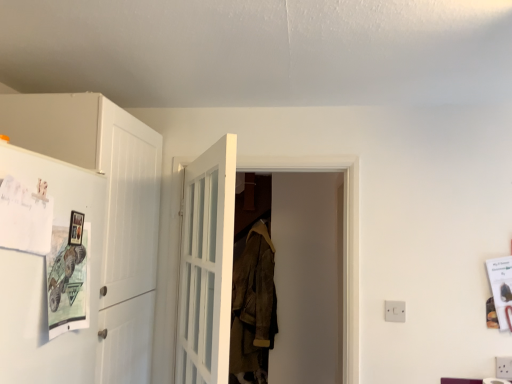
Question: Is white matte refrigerator at left oriented towards leather jacket at center?

Choices:
 (A) yes
 (B) no

Answer: (B)

Question: Is white matte refrigerator at left far away from leather jacket at center?

Choices:
 (A) no
 (B) yes

Answer: (B)

Question: Is white matte refrigerator at left beside leather jacket at center?

Choices:
 (A) no
 (B) yes

Answer: (A)

Question: Considering the relative sizes of white matte refrigerator at left and leather jacket at center in the image provided, is white matte refrigerator at left wider than leather jacket at center?

Choices:
 (A) no
 (B) yes

Answer: (B)

Question: Considering the relative sizes of white matte refrigerator at left and leather jacket at center in the image provided, is white matte refrigerator at left taller than leather jacket at center?

Choices:
 (A) no
 (B) yes

Answer: (B)

Question: Is white glass door at center, the 2th door viewed from the back, bigger or smaller than white matte refrigerator at left?

Choices:
 (A) small
 (B) big

Answer: (A)

Question: From the image's perspective, is white glass door at center, the first door positioned from the front, above or below white matte refrigerator at left?

Choices:
 (A) below
 (B) above

Answer: (A)

Question: Considering the relative positions of white glass door at center, the 2th door viewed from the back, and white matte refrigerator at left in the image provided, is white glass door at center, the 2th door viewed from the back, to the left or to the right of white matte refrigerator at left?

Choices:
 (A) left
 (B) right

Answer: (B)

Question: From a real-world perspective, is white glass door at center, the 2th door viewed from the back, above or below white matte refrigerator at left?

Choices:
 (A) above
 (B) below

Answer: (B)

Question: Based on their sizes in the image, would you say leather jacket at center is bigger or smaller than white glass door at center, the 2th door viewed from the back?

Choices:
 (A) small
 (B) big

Answer: (B)

Question: Would you say leather jacket at center is inside or outside white glass door at center, the first door positioned from the front?

Choices:
 (A) inside
 (B) outside

Answer: (B)

Question: Is leather jacket at center taller or shorter than white glass door at center, the 2th door viewed from the back?

Choices:
 (A) short
 (B) tall

Answer: (B)

Question: From a real-world perspective, is leather jacket at center physically located above or below white glass door at center, the 2th door viewed from the back?

Choices:
 (A) above
 (B) below

Answer: (B)

Question: Considering the relative positions of white plastic electric outlet at lower right and white matte refrigerator at left in the image provided, is white plastic electric outlet at lower right to the left or to the right of white matte refrigerator at left?

Choices:
 (A) left
 (B) right

Answer: (B)

Question: Choose the correct answer: Is white plastic electric outlet at lower right inside white matte refrigerator at left or outside it?

Choices:
 (A) inside
 (B) outside

Answer: (B)